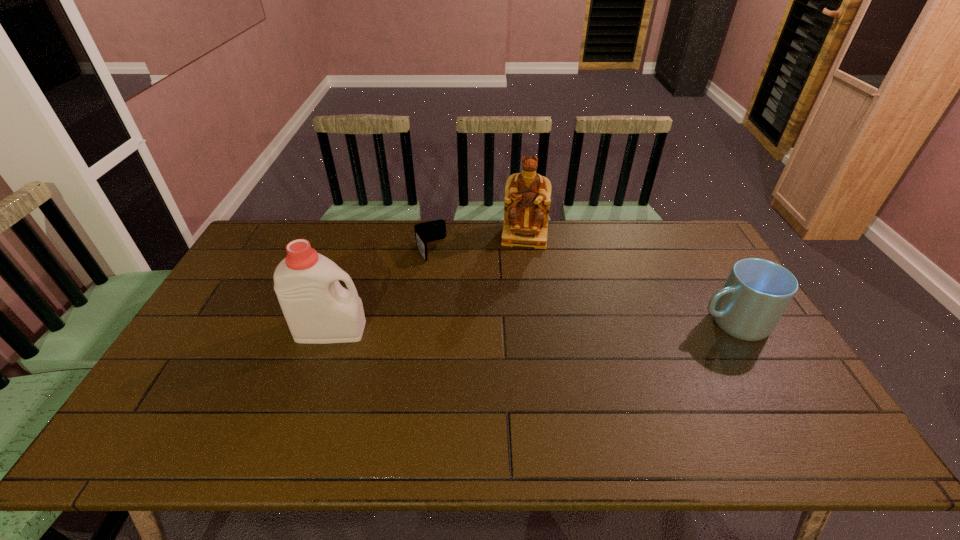
This screenshot has height=540, width=960. In order to click on vacant space situated 0.280m on the front-facing side of the second object from right to left in this screenshot , I will do `click(516, 305)`.

Where is `vacant area located on the outer surface of the second object from left to right`? vacant area located on the outer surface of the second object from left to right is located at coordinates (440, 272).

Locate an element on the screen. Image resolution: width=960 pixels, height=540 pixels. vacant area located on the outer surface of the second object from left to right is located at coordinates (471, 328).

You are a GUI agent. You are given a task and a screenshot of the screen. Output one action in this format:
    pyautogui.click(x=<x>, y=<y>)
    Task: Click on the blank space located 0.270m on the outer surface of the second object from left to right
    
    Given the screenshot: What is the action you would take?
    pyautogui.click(x=465, y=316)

In order to click on figurine that is at the far edge in this screenshot , I will do `click(527, 200)`.

Where is `wallet at the far edge`? Image resolution: width=960 pixels, height=540 pixels. wallet at the far edge is located at coordinates (429, 231).

At what (x,y) coordinates should I click in order to perform the action: click on object located in the right edge section of the desktop. Please return your answer as a coordinate pair (x, y). Looking at the image, I should click on (757, 292).

At what (x,y) coordinates should I click in order to perform the action: click on vacant space at the far edge of the desktop. Please return your answer as a coordinate pair (x, y). Image resolution: width=960 pixels, height=540 pixels. Looking at the image, I should click on (539, 253).

Find the location of a particular element. free space at the near edge of the desktop is located at coordinates (566, 407).

In order to click on vacant space at the left edge in this screenshot , I will do `click(235, 292)`.